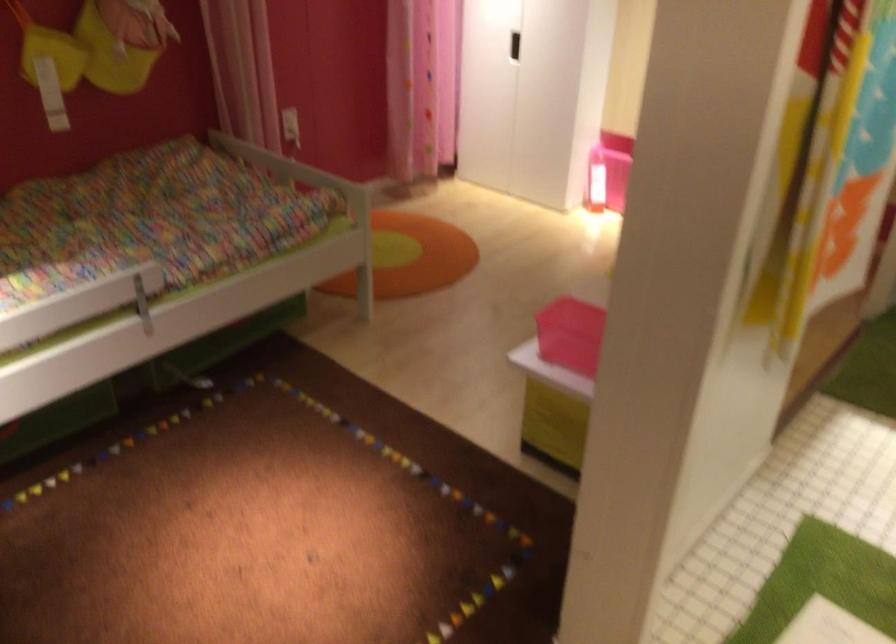
What do you see at coordinates (297, 172) in the screenshot? I see `the metal bed rail handle` at bounding box center [297, 172].